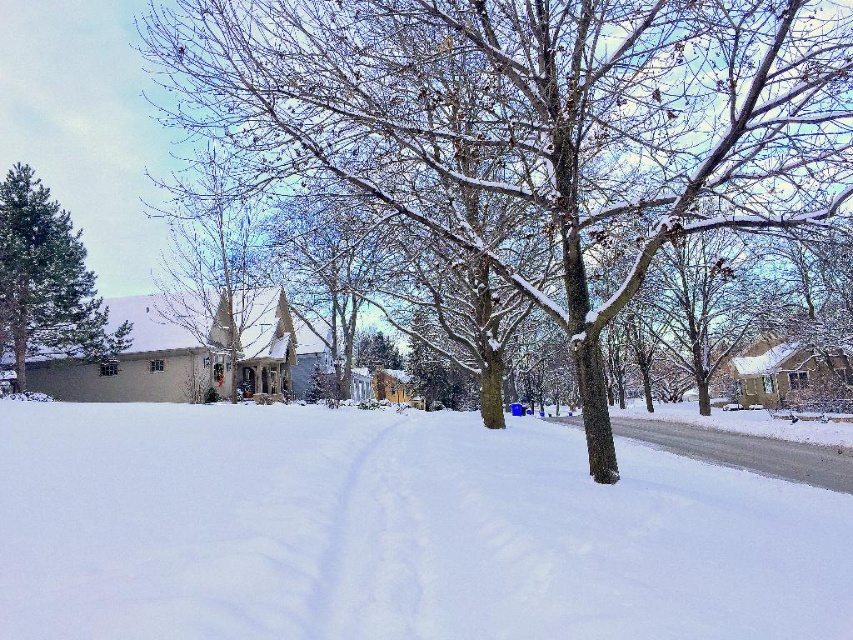
Question: Does white fluffy snow at center have a greater width compared to snow-covered tree at center?

Choices:
 (A) yes
 (B) no

Answer: (B)

Question: Observing the image, what is the correct spatial positioning of white fluffy snow at center in reference to snow-covered tree at center?

Choices:
 (A) above
 (B) below

Answer: (B)

Question: Which point appears farthest from the camera in this image?

Choices:
 (A) (766, 554)
 (B) (16, 268)
 (C) (746, 13)

Answer: (B)

Question: Which point is closer to the camera?

Choices:
 (A) snow-covered tree at center
 (B) white fluffy snow at center

Answer: (B)

Question: Which of the following is the closest to the observer?

Choices:
 (A) (572, 470)
 (B) (566, 92)

Answer: (B)

Question: From the image, what is the correct spatial relationship of white fluffy snow at center in relation to green matte tree at upper left?

Choices:
 (A) above
 (B) below

Answer: (B)